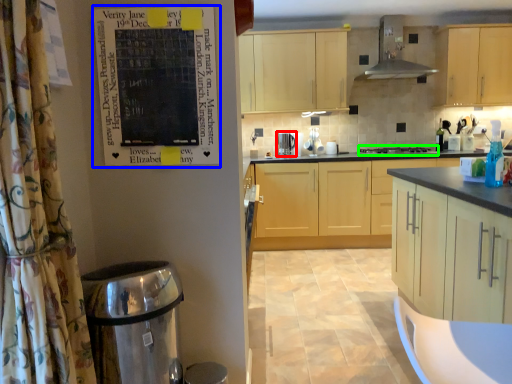
Question: Based on their relative distances, which object is farther from kitchen appliance (highlighted by a red box)? Choose from bulletin board (highlighted by a blue box) and gas stove (highlighted by a green box).

Choices:
 (A) bulletin board
 (B) gas stove

Answer: (A)